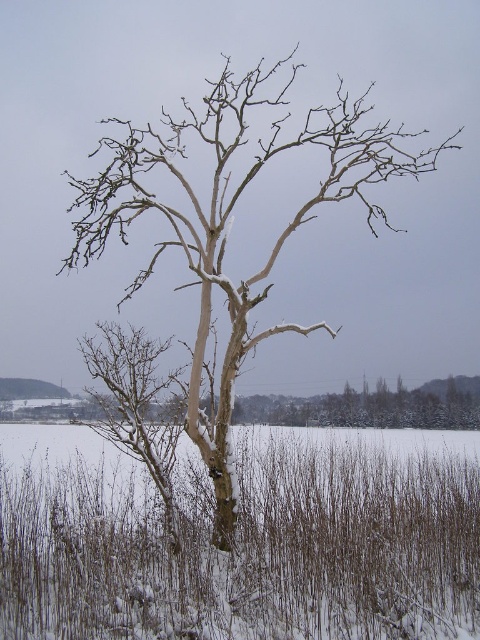
You are standing at the edge of the snowy field and want to reach the point where the snowy grass at center is located. According to the coordinates provided, in which direction should you walk from your current position to reach it?

The snowy grass at center is located at coordinates point (242, 538). Since you are at the edge of the snowy field, you should walk towards the center of the field to reach it.